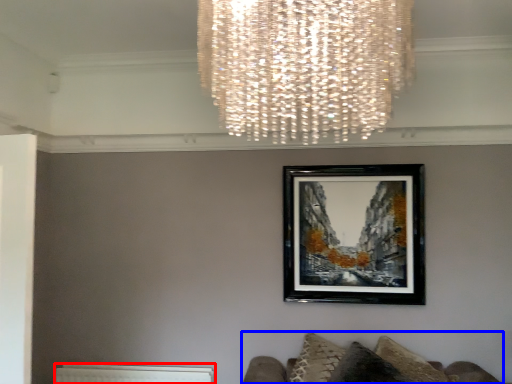
Question: Which point is further to the camera, radiator (highlighted by a red box) or furniture (highlighted by a blue box)?

Choices:
 (A) radiator
 (B) furniture

Answer: (A)